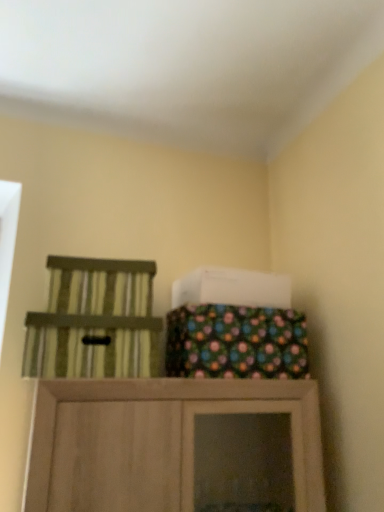
Measure the distance between point (121, 290) and camera.

The depth of point (121, 290) is 1.35 meters.

Identify the location of green striped chair at left. This screenshot has width=384, height=512. (94, 320).

What do you see at coordinates (94, 320) in the screenshot?
I see `green striped chair at left` at bounding box center [94, 320].

At what (x,y) coordinates should I click in order to perform the action: click on polka dot fabric bag at upper center. Please return your answer as a coordinate pair (x, y). The width and height of the screenshot is (384, 512). Looking at the image, I should click on (236, 342).

What do you see at coordinates (236, 342) in the screenshot? I see `polka dot fabric bag at upper center` at bounding box center [236, 342].

Where is `green striped chair at left`? Image resolution: width=384 pixels, height=512 pixels. green striped chair at left is located at coordinates (94, 320).

In the image, is polka dot fabric bag at upper center on the left side or the right side of green striped chair at left?

Clearly, polka dot fabric bag at upper center is on the right of green striped chair at left in the image.

Who is more distant, polka dot fabric bag at upper center or green striped chair at left?

polka dot fabric bag at upper center is behind.

Is point (247, 324) closer or farther from the camera than point (129, 341)?

Point (247, 324) is farther from the camera than point (129, 341).

From the image's perspective, between polka dot fabric bag at upper center and green striped chair at left, who is located below?

green striped chair at left, from the image's perspective.

From a real-world perspective, is polka dot fabric bag at upper center on green striped chair at left?

Yes.

Between polka dot fabric bag at upper center and green striped chair at left, which one has smaller width?

polka dot fabric bag at upper center.

Considering the sizes of objects polka dot fabric bag at upper center and green striped chair at left in the image provided, who is taller, polka dot fabric bag at upper center or green striped chair at left?

polka dot fabric bag at upper center is taller.

Is polka dot fabric bag at upper center smaller than green striped chair at left?

No, polka dot fabric bag at upper center is not smaller than green striped chair at left.

Is polka dot fabric bag at upper center outside of green striped chair at left?

That's correct, polka dot fabric bag at upper center is outside of green striped chair at left.

Is polka dot fabric bag at upper center placed right next to green striped chair at left?

No, polka dot fabric bag at upper center is not with green striped chair at left.

Could you tell me if polka dot fabric bag at upper center is turned towards green striped chair at left?

No, polka dot fabric bag at upper center does not turn towards green striped chair at left.

What's the angular difference between polka dot fabric bag at upper center and green striped chair at left's facing directions?

The facing directions of polka dot fabric bag at upper center and green striped chair at left are 0.379 degrees apart.

Image resolution: width=384 pixels, height=512 pixels. I want to click on material above the green striped chair at left (from the image's perspective), so click(x=236, y=342).

Which object is positioned more to the left, green striped chair at left or polka dot fabric bag at upper center?

From the viewer's perspective, green striped chair at left appears more on the left side.

Is green striped chair at left closer to the viewer compared to polka dot fabric bag at upper center?

Yes.

Consider the image. Which is nearer, (95, 275) or (250, 366)?

Clearly, point (95, 275) is closer to the camera than point (250, 366).

From the image's perspective, which one is positioned higher, green striped chair at left or polka dot fabric bag at upper center?

polka dot fabric bag at upper center, from the image's perspective.

From a real-world perspective, between green striped chair at left and polka dot fabric bag at upper center, who is vertically higher?

In real-world perspective, polka dot fabric bag at upper center is above.

Which object is wider, green striped chair at left or polka dot fabric bag at upper center?

With larger width is green striped chair at left.

Which of these two, green striped chair at left or polka dot fabric bag at upper center, stands taller?

polka dot fabric bag at upper center.

Does green striped chair at left have a smaller size compared to polka dot fabric bag at upper center?

Indeed, green striped chair at left has a smaller size compared to polka dot fabric bag at upper center.

Is green striped chair at left spatially inside polka dot fabric bag at upper center, or outside of it?

green striped chair at left exists outside the volume of polka dot fabric bag at upper center.

Are green striped chair at left and polka dot fabric bag at upper center located far from each other?

No, green striped chair at left is not far away from polka dot fabric bag at upper center.

Could you tell me if green striped chair at left is turned towards polka dot fabric bag at upper center?

No, green striped chair at left does not turn towards polka dot fabric bag at upper center.

Measure the distance between green striped chair at left and polka dot fabric bag at upper center.

The distance of green striped chair at left from polka dot fabric bag at upper center is 11.61 inches.

Identify the location of material behind the green striped chair at left. (236, 342).

This screenshot has width=384, height=512. Identify the location of material that is above the green striped chair at left (from a real-world perspective). (236, 342).

Identify the location of chair below the polka dot fabric bag at upper center (from a real-world perspective). (94, 320).